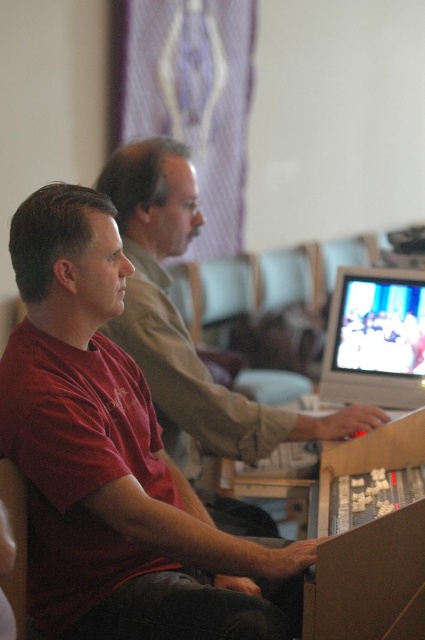
Can you confirm if matte red shirt at center is shorter than matte plastic monitor at center right?

In fact, matte red shirt at center may be taller than matte plastic monitor at center right.

Can you confirm if matte red shirt at center is smaller than matte plastic monitor at center right?

Incorrect, matte red shirt at center is not smaller in size than matte plastic monitor at center right.

What do you see at coordinates (183, 321) in the screenshot? I see `matte red shirt at center` at bounding box center [183, 321].

You are a GUI agent. You are given a task and a screenshot of the screen. Output one action in this format:
    pyautogui.click(x=<x>, y=<y>)
    Task: Click on the matte red shirt at center
    The image size is (425, 640).
    Given the screenshot: What is the action you would take?
    pyautogui.click(x=183, y=321)